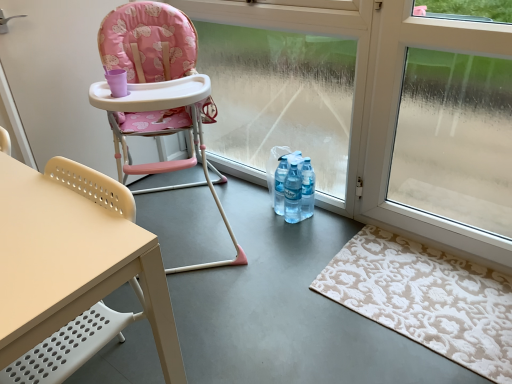
Where is `free area in between pink fabric highchair at left, marked as the 2th chair in a front-to-back arrangement, and translucent plastic bottles at center`? The width and height of the screenshot is (512, 384). free area in between pink fabric highchair at left, marked as the 2th chair in a front-to-back arrangement, and translucent plastic bottles at center is located at coordinates (261, 218).